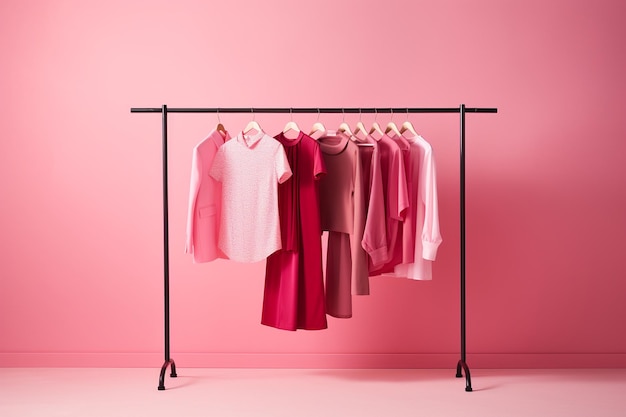
This screenshot has height=417, width=626. Find the location of `hangers`. hangers is located at coordinates (222, 127), (250, 128), (294, 128), (324, 129), (342, 127), (357, 127), (374, 128), (387, 128), (409, 128).